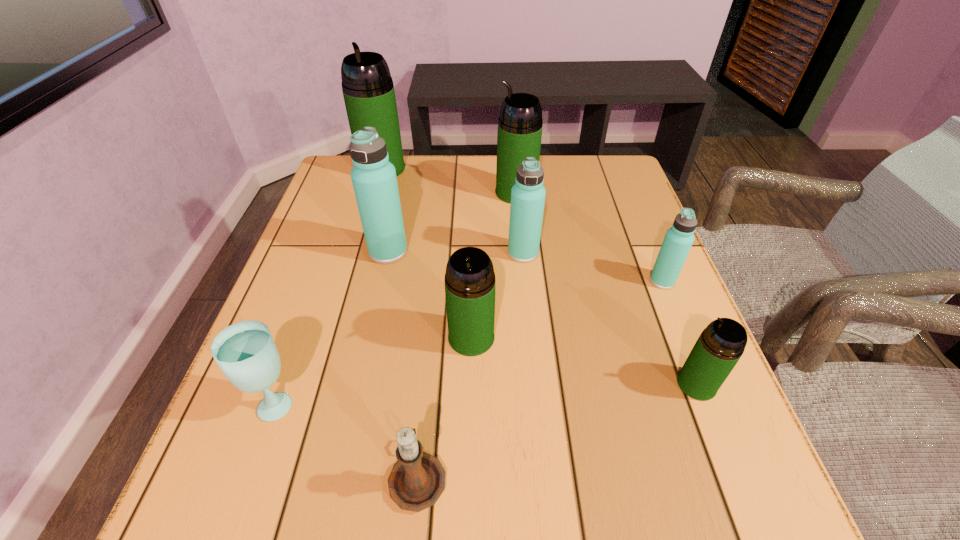
Locate an element on the screen. The image size is (960, 540). free location located on the back of the smallest aqua thermos bottle is located at coordinates pyautogui.click(x=625, y=190).

Identify the location of free space located 0.080m from the spout of the nearest thermos bottle. This screenshot has height=540, width=960. (632, 384).

Where is `vacant space located 0.190m from the spout of the nearest thermos bottle`? vacant space located 0.190m from the spout of the nearest thermos bottle is located at coordinates (569, 384).

Locate an element on the screen. The image size is (960, 540). vacant space positioned from the spout of the nearest thermos bottle is located at coordinates (598, 384).

Find the location of `vacant area situated 0.180m on the back of the glass`. vacant area situated 0.180m on the back of the glass is located at coordinates (312, 305).

Locate an element on the screen. free region located on the side of the candle holder with the handle is located at coordinates (437, 284).

Find the location of a particular element. vacant area situated on the side of the candle holder with the handle is located at coordinates (425, 401).

Identify the location of vacant space located on the side of the candle holder with the handle. The image size is (960, 540). (434, 312).

Identify the location of object present at the near edge. (417, 480).

Locate an element on the screen. This screenshot has height=540, width=960. glass that is at the left edge is located at coordinates (245, 351).